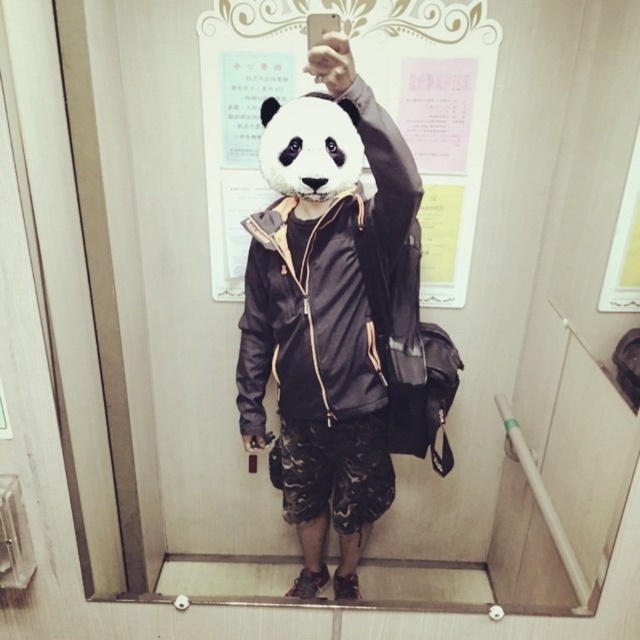
Looking at this image, you are designing a poster for an event and need to place both the matte white paper at upper center and the white matte panda at center in the elevator scene. Which object should you choose if you want to use the one that takes up more space?

The matte white paper at upper center should be chosen because it is larger in size than the white matte panda at center, making it the better option for taking up more space.

You are a photographer trying to capture a clear photo of the matte white paper at upper center and the matte black jacket at center in the elevator scene. Which object is located to the right of the other?

The matte white paper at upper center is positioned on the right side of matte black jacket at center.

You are a photographer trying to capture the subject wearing a panda mask while ensuring the matte black jacket at center and white matte panda at center are both visible in the frame. Based on their positions, which object should you focus on to include both in the shot?

The matte black jacket at center is to the right of the white matte panda at center, so focusing on the area between them would ensure both are visible in the frame.